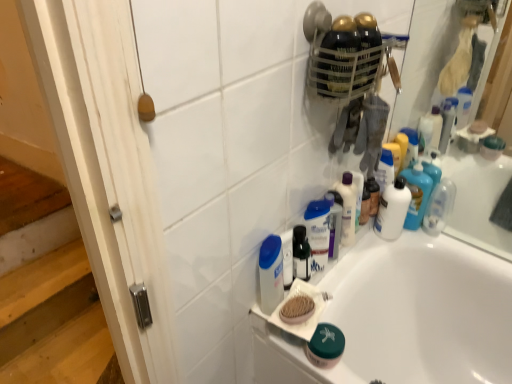
This screenshot has width=512, height=384. Describe the element at coordinates (392, 210) in the screenshot. I see `white glossy bottle at upper right, which is counted as the first mouthwash, starting from the back` at that location.

What is the approximate height of white glossy lotion at upper center, marked as the second toiletry in a left-to-right arrangement?

It is 8.02 inches.

This screenshot has width=512, height=384. In order to click on clear plastic bottle at upper right, which is counted as the first toiletry, starting from the right in this screenshot , I will do `click(439, 207)`.

The image size is (512, 384). Find the location of `wooden brush at upper right`. wooden brush at upper right is located at coordinates (297, 309).

Find the location of a particular element. The height and width of the screenshot is (384, 512). white glossy bottle at upper right, which is counted as the first mouthwash, starting from the back is located at coordinates 392,210.

Which of these two, white glossy bottle at upper right, acting as the 3th mouthwash starting from the left, or light brown wooden stairs at lower left, is bigger?

Bigger between the two is light brown wooden stairs at lower left.

Which object is more forward, white glossy bottle at upper right, acting as the 3th mouthwash starting from the left, or light brown wooden stairs at lower left?

white glossy bottle at upper right, acting as the 3th mouthwash starting from the left.

Could you tell me if translucent plastic mouthwash at center, the second mouthwash positioned from the front, is turned towards wooden brush at upper right?

No, translucent plastic mouthwash at center, the second mouthwash positioned from the front, is not facing towards wooden brush at upper right.

From the image's perspective, which is below, translucent plastic mouthwash at center, arranged as the second mouthwash when viewed from the left, or wooden brush at upper right?

wooden brush at upper right.

Is translucent plastic mouthwash at center, the 2th mouthwash when ordered from right to left, taller than wooden brush at upper right?

Yes, translucent plastic mouthwash at center, the 2th mouthwash when ordered from right to left, is taller than wooden brush at upper right.

From the image's perspective, is translucent plastic bottles at upper right, the second toiletry from the right, located above white glossy bathtub at lower center?

Yes, from the image's perspective, translucent plastic bottles at upper right, the second toiletry from the right, is on top of white glossy bathtub at lower center.

In terms of size, does translucent plastic bottles at upper right, which is the third toiletry from left to right, appear bigger or smaller than white glossy bathtub at lower center?

In the image, translucent plastic bottles at upper right, which is the third toiletry from left to right, appears to be smaller than white glossy bathtub at lower center.

Can you confirm if translucent plastic bottles at upper right, the second toiletry from the right, is positioned to the right of white glossy bathtub at lower center?

No, translucent plastic bottles at upper right, the second toiletry from the right, is not to the right of white glossy bathtub at lower center.

From a real-world perspective, is white glossy bathtub at lower center located higher than wooden brush at upper right?

No.

From the image's perspective, would you say white glossy bathtub at lower center is positioned over wooden brush at upper right?

No, from the image's perspective, white glossy bathtub at lower center is not above wooden brush at upper right.

Is wooden brush at upper right a part of white glossy bathtub at lower center?

No, wooden brush at upper right is not a part of white glossy bathtub at lower center.

Which of these two, white glossy bathtub at lower center or wooden brush at upper right, is bigger?

white glossy bathtub at lower center is bigger.

Consider the image. In the image, is white glossy bathtub at lower center on the left side or the right side of light brown wooden stairs at lower left?

white glossy bathtub at lower center is to the right of light brown wooden stairs at lower left.

Could light brown wooden stairs at lower left be considered to be inside white glossy bathtub at lower center?

Actually, light brown wooden stairs at lower left is outside white glossy bathtub at lower center.

Is point (334, 317) positioned after point (0, 361)?

No, (334, 317) is closer to viewer.

Considering the sizes of objects wooden brush at upper right and white glossy bottle at upper right, which is counted as the first mouthwash, starting from the back, in the image provided, who is smaller, wooden brush at upper right or white glossy bottle at upper right, which is counted as the first mouthwash, starting from the back,?

wooden brush at upper right is smaller.

Can you tell me how much wooden brush at upper right and white glossy bottle at upper right, which is counted as the first mouthwash, starting from the back, differ in facing direction?

The facing directions of wooden brush at upper right and white glossy bottle at upper right, which is counted as the first mouthwash, starting from the back, are 2.05 degrees apart.

From the picture: Does wooden brush at upper right touch white glossy bottle at upper right, acting as the 3th mouthwash starting from the left?

No, wooden brush at upper right is not touching white glossy bottle at upper right, acting as the 3th mouthwash starting from the left.

How far apart are wooden brush at upper right and white glossy bottle at upper right, which is counted as the first mouthwash, starting from the back?

wooden brush at upper right and white glossy bottle at upper right, which is counted as the first mouthwash, starting from the back, are 49.08 centimeters apart from each other.

Is translucent plastic bottles at upper right, the second toiletry from the right, shorter than translucent plastic mouthwash at center, the 2th mouthwash when ordered from right to left?

Incorrect, the height of translucent plastic bottles at upper right, the second toiletry from the right, does not fall short of that of translucent plastic mouthwash at center, the 2th mouthwash when ordered from right to left.

Is translucent plastic mouthwash at center, the 2th mouthwash when ordered from right to left, surrounded by translucent plastic bottles at upper right, the second toiletry from the right?

No, translucent plastic bottles at upper right, the second toiletry from the right, does not contain translucent plastic mouthwash at center, the 2th mouthwash when ordered from right to left.

You are a GUI agent. You are given a task and a screenshot of the screen. Output one action in this format:
    pyautogui.click(x=<x>, y=<y>)
    Task: Click on the 3rd toiletry counting from the right side of the translucent plastic mouthwash at center, the second mouthwash positioned from the front
    The height and width of the screenshot is (384, 512).
    Given the screenshot: What is the action you would take?
    pyautogui.click(x=347, y=208)

The height and width of the screenshot is (384, 512). In order to click on the 1st mouthwash above the light brown wooden stairs at lower left (from a real-world perspective) in this screenshot , I will do `click(392, 210)`.

Where is `the 2nd mouthwash above when counting from the wooden brush at upper right (from the image's perspective)`? the 2nd mouthwash above when counting from the wooden brush at upper right (from the image's perspective) is located at coordinates (318, 232).

Considering their positions, is white glossy lotion at upper center, acting as the third toiletry starting from the right, positioned further to white plastic mouthwash at center, the 3th mouthwash in the back-to-front sequence, than translucent plastic mouthwash at center, the second mouthwash when ordered from back to front?

Among the two, white glossy lotion at upper center, acting as the third toiletry starting from the right, is located further to white plastic mouthwash at center, the 3th mouthwash in the back-to-front sequence.

Looking at the image, which one is located further to light brown wooden stairs at lower left, white wood screen door at left or green matte jar at lower center, the fourth toiletry from the right?

green matte jar at lower center, the fourth toiletry from the right, is further to light brown wooden stairs at lower left.

Considering their positions, is translucent plastic bottles at upper right, which is the third toiletry from left to right, positioned further to light brown wooden stairs at lower left than wooden brush at upper right?

translucent plastic bottles at upper right, which is the third toiletry from left to right, is positioned further to the anchor light brown wooden stairs at lower left.

Estimate the real-world distances between objects in this image. Which object is closer to white glossy lotion at upper center, marked as the second toiletry in a left-to-right arrangement, translucent plastic mouthwash at center, the second mouthwash positioned from the front, or white glossy bottle at upper right, which is counted as the first mouthwash, starting from the back?

translucent plastic mouthwash at center, the second mouthwash positioned from the front, is closer to white glossy lotion at upper center, marked as the second toiletry in a left-to-right arrangement.

Which object lies further to the anchor point light brown wooden stairs at lower left, white glossy bathtub at lower center or translucent plastic mouthwash at center, the 2th mouthwash when ordered from right to left?

translucent plastic mouthwash at center, the 2th mouthwash when ordered from right to left, lies further to light brown wooden stairs at lower left than the other object.

When comparing their distances from translucent plastic mouthwash at center, the second mouthwash positioned from the front, does white glossy bottle at upper right, acting as the 3th mouthwash starting from the left, or white glossy bathtub at lower center seem further?

white glossy bathtub at lower center is positioned further to the anchor translucent plastic mouthwash at center, the second mouthwash positioned from the front.

Considering their positions, is translucent plastic mouthwash at center, the second mouthwash positioned from the front, positioned further to white glossy bottle at upper right, which is counted as the first mouthwash, starting from the back, than translucent plastic bottles at upper right, which is the third toiletry from left to right?

translucent plastic mouthwash at center, the second mouthwash positioned from the front, is positioned further to the anchor white glossy bottle at upper right, which is counted as the first mouthwash, starting from the back.

Based on their spatial positions, is white glossy bathtub at lower center or green matte jar at lower center, which appears as the first toiletry when viewed from the left, closer to white glossy lotion at upper center, acting as the third toiletry starting from the right?

green matte jar at lower center, which appears as the first toiletry when viewed from the left, is closer to white glossy lotion at upper center, acting as the third toiletry starting from the right.

Identify the location of soap located between white wood screen door at left and clear plastic bottle at upper right, which is the 4th toiletry from left to right, in the left-right direction. This screenshot has height=384, width=512. (x=297, y=309).

Where is `mouthwash between wooden brush at upper right and white glossy bottle at upper right, which is counted as the first mouthwash, starting from the back, from left to right`? mouthwash between wooden brush at upper right and white glossy bottle at upper right, which is counted as the first mouthwash, starting from the back, from left to right is located at coordinates (318, 232).

You are a GUI agent. You are given a task and a screenshot of the screen. Output one action in this format:
    pyautogui.click(x=<x>, y=<y>)
    Task: Click on the soap situated between white plastic mouthwash at center, which ranks as the first mouthwash in left-to-right order, and white glossy bathtub at lower center from left to right
    Image resolution: width=512 pixels, height=384 pixels.
    Given the screenshot: What is the action you would take?
    pyautogui.click(x=297, y=309)

This screenshot has height=384, width=512. Find the location of `mouthwash between white plastic mouthwash at center, which ranks as the first mouthwash in left-to-right order, and white glossy lotion at upper center, acting as the third toiletry starting from the right, from left to right`. mouthwash between white plastic mouthwash at center, which ranks as the first mouthwash in left-to-right order, and white glossy lotion at upper center, acting as the third toiletry starting from the right, from left to right is located at coordinates (318, 232).